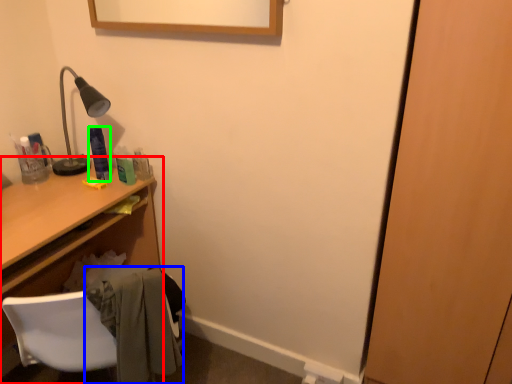
Question: Which object is the farthest from desk (highlighted by a red box)? Choose among these: clothe (highlighted by a blue box) or toiletry (highlighted by a green box).

Choices:
 (A) clothe
 (B) toiletry

Answer: (A)